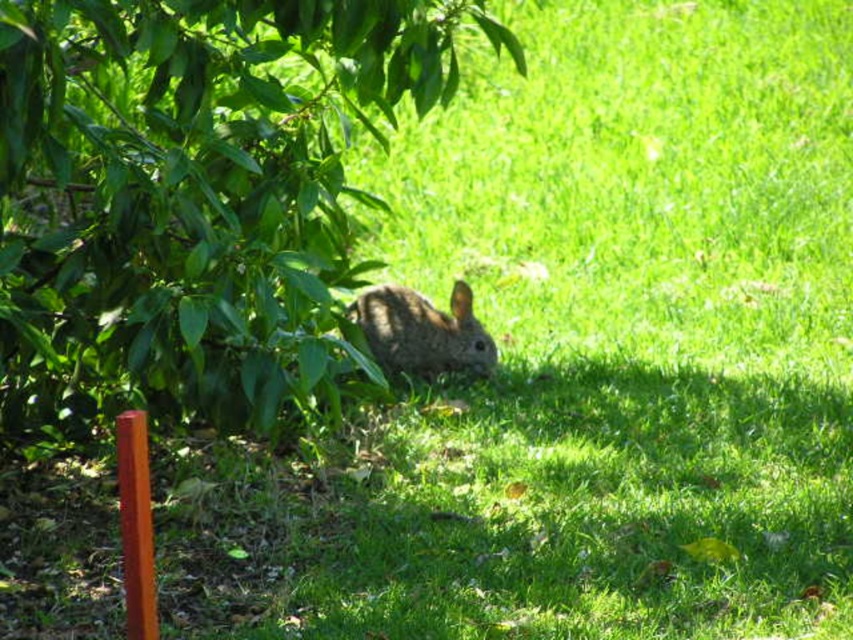
Question: Is green leafy tree at center smaller than fuzzy brown rabbit at center?

Choices:
 (A) yes
 (B) no

Answer: (B)

Question: Which of the following is the closest to the observer?

Choices:
 (A) fuzzy brown rabbit at center
 (B) green leafy tree at center

Answer: (B)

Question: Can you confirm if green leafy tree at center is positioned to the left of fuzzy brown rabbit at center?

Choices:
 (A) yes
 (B) no

Answer: (A)

Question: Which of the following is the closest to the observer?

Choices:
 (A) fuzzy brown rabbit at center
 (B) green leafy tree at center

Answer: (B)

Question: From the image, what is the correct spatial relationship of green leafy tree at center in relation to fuzzy brown rabbit at center?

Choices:
 (A) above
 (B) below

Answer: (A)